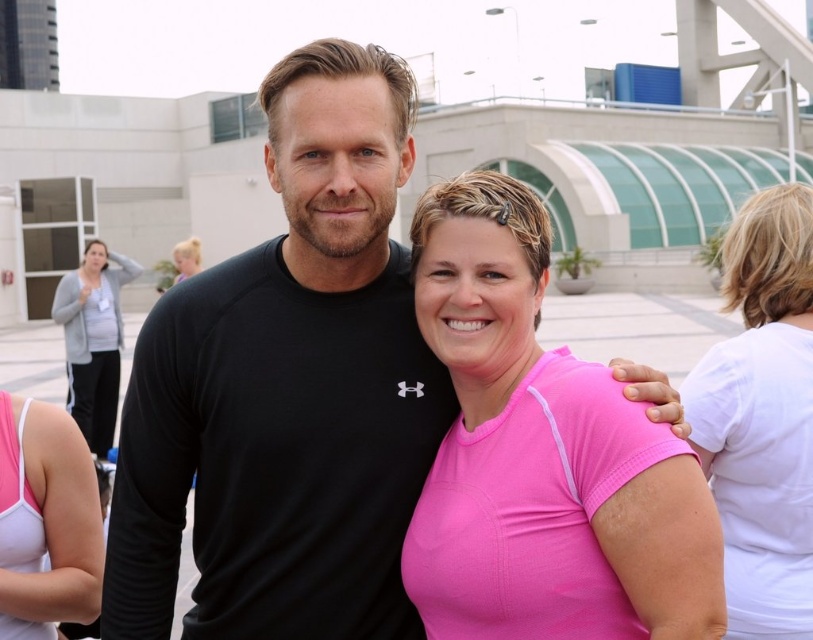
Between black matte t-shirt at center and pink matte shirt at center, which one has more height?

Standing taller between the two is black matte t-shirt at center.

Who is higher up, black matte t-shirt at center or pink matte shirt at center?

black matte t-shirt at center is above.

Locate an element on the screen. This screenshot has height=640, width=813. black matte t-shirt at center is located at coordinates (288, 390).

In order to click on black matte t-shirt at center in this screenshot , I will do `click(288, 390)`.

Which of these two, pink matte shirt at center or white matte t-shirt at right, stands shorter?

pink matte shirt at center is shorter.

Can you confirm if pink matte shirt at center is positioned above white matte t-shirt at right?

Indeed, pink matte shirt at center is positioned over white matte t-shirt at right.

The width and height of the screenshot is (813, 640). What are the coordinates of `pink matte shirt at center` in the screenshot? It's located at (541, 456).

Does white matte t-shirt at right have a greater height compared to pink fabric shirt at upper center?

No.

Identify the location of white matte t-shirt at right. (762, 417).

Where is `white matte t-shirt at right`? The image size is (813, 640). white matte t-shirt at right is located at coordinates (762, 417).